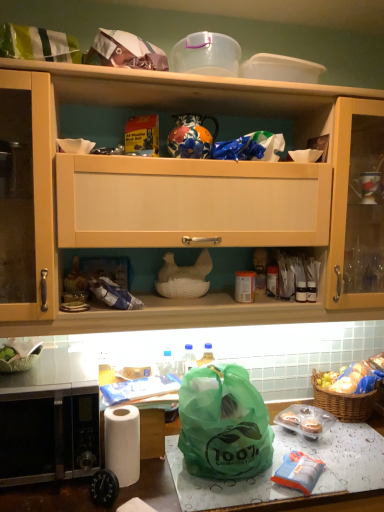
Question: In terms of size, does green plastic bag at lower right, which is the 1th food from back to front, appear bigger or smaller than stainless steel microwave at lower left?

Choices:
 (A) big
 (B) small

Answer: (B)

Question: From their relative heights in the image, would you say green plastic bag at lower right, which is the 1th food from back to front, is taller or shorter than stainless steel microwave at lower left?

Choices:
 (A) short
 (B) tall

Answer: (A)

Question: Based on their relative distances, which object is nearer to the translucent plastic cupcakes at lower right, the second food positioned from the top?

Choices:
 (A) translucent plastic bag at lower center, the 1th food from the bottom
 (B) transparent plastic container at upper center
 (C) green plastic bag at lower center
 (D) green plastic bag at lower right, which is counted as the first food, starting from the top
 (E) brown woven picnic basket at lower right

Answer: (E)

Question: Which of these objects is positioned farthest from the white matte paper towel at lower left?

Choices:
 (A) green plastic bag at lower center
 (B) stainless steel microwave at lower left
 (C) green plastic bag at lower right, which is the 1th food from back to front
 (D) transparent plastic container at upper center
 (E) green plastic bag at lower center

Answer: (D)